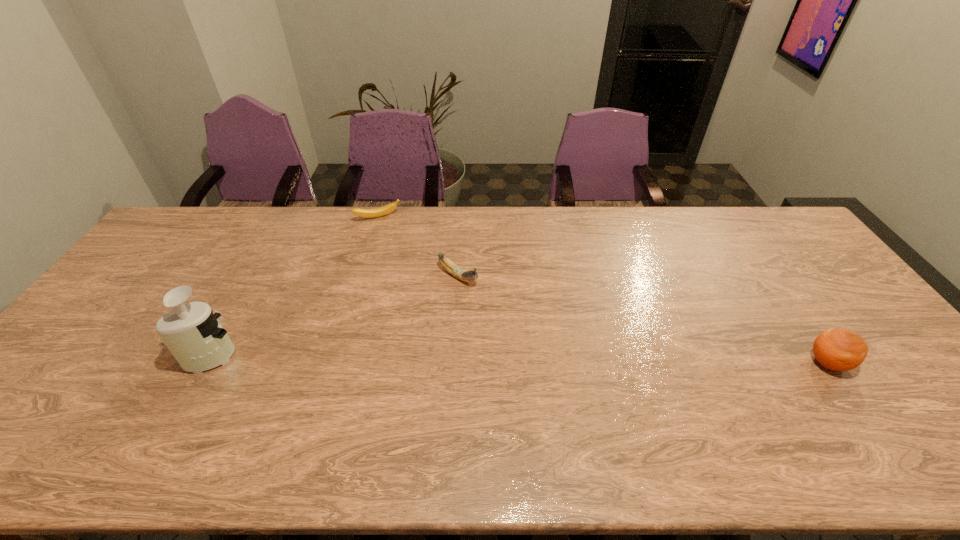
Locate an element on the screen. free space on the desktop that is between the juicer and the orange and is positioned on the peel of the taller banana is located at coordinates (586, 360).

Where is `vacant space on the desktop that is between the leftmost object and the rightmost object and is positioned at the stem of the shorter banana`? vacant space on the desktop that is between the leftmost object and the rightmost object and is positioned at the stem of the shorter banana is located at coordinates (452, 357).